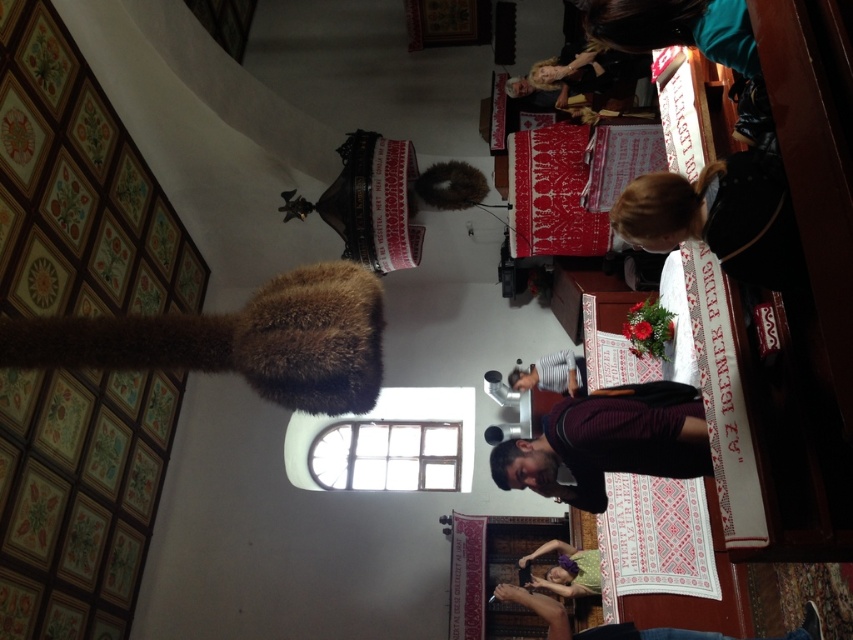
Question: Can you confirm if maroon sweater at center is bigger than brown furry hat at center?

Choices:
 (A) yes
 (B) no

Answer: (A)

Question: Which of the following is the farthest from the observer?

Choices:
 (A) striped cotton shirt at center
 (B) brown furry hat at center
 (C) green floral dress at center

Answer: (B)

Question: Considering the relative positions of wooden at center and smooth brown hair at lower center in the image provided, where is wooden at center located with respect to smooth brown hair at lower center?

Choices:
 (A) below
 (B) above

Answer: (A)

Question: Which point is farther to the camera?

Choices:
 (A) striped cotton shirt at center
 (B) maroon sweater at center
 (C) green floral dress at center

Answer: (A)

Question: Considering the relative positions of wooden at center and striped cotton shirt at center in the image provided, where is wooden at center located with respect to striped cotton shirt at center?

Choices:
 (A) below
 (B) above

Answer: (A)

Question: Among these objects, which one is farthest from the camera?

Choices:
 (A) striped cotton shirt at center
 (B) brown furry hat at center

Answer: (B)